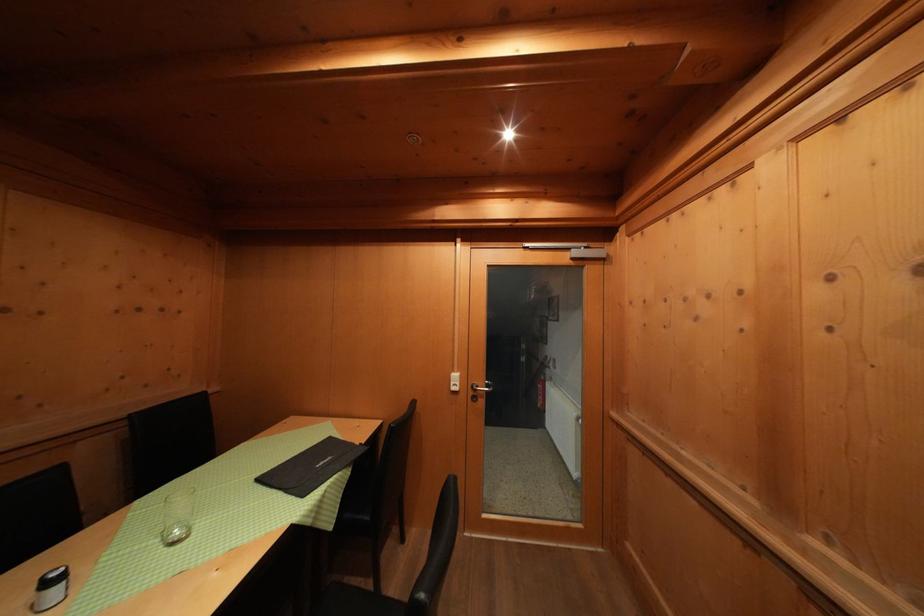
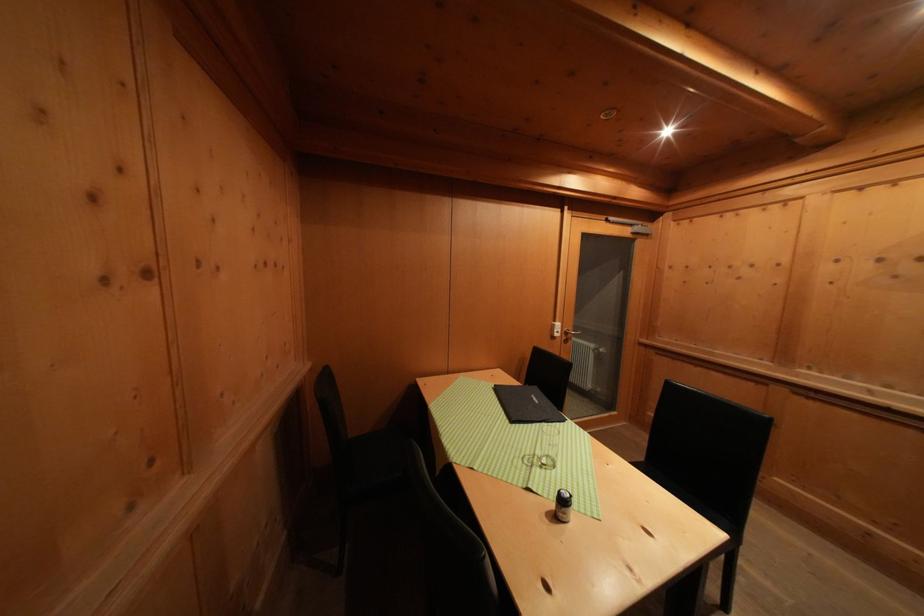
Question: What movement of the cameraman would produce the second image?

Choices:
 (A) Left
 (B) Right
 (C) Forward
 (D) Backward

Answer: (A)